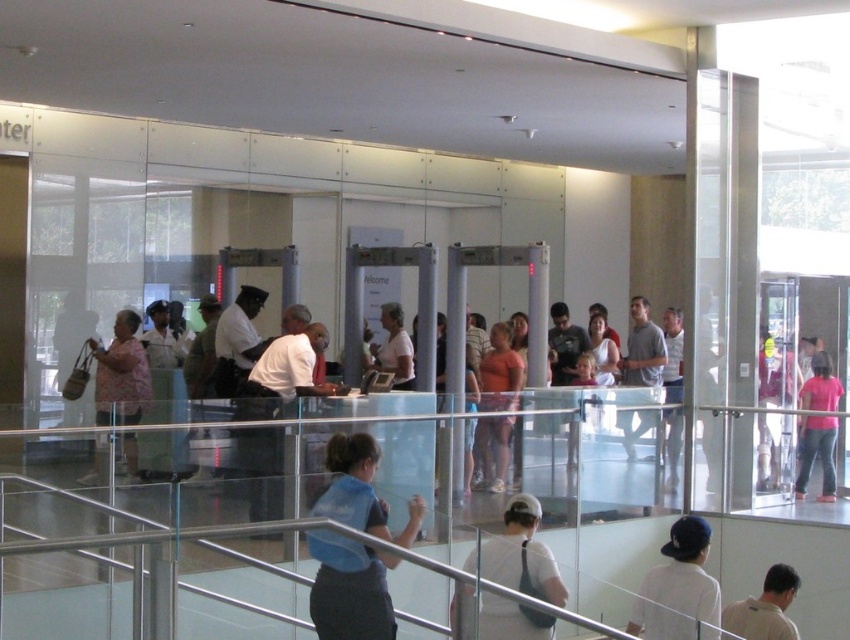
Question: Which object is positioned farthest from the pink fabric shirt at right?

Choices:
 (A) matte pink blouse at center
 (B) white matte uniform at center

Answer: (A)

Question: Which object is positioned closest to the matte pink blouse at center?

Choices:
 (A) white matte cap at upper center
 (B) white matte uniform at center
 (C) pink fabric shirt at right
 (D) blue fabric at center

Answer: (B)

Question: Does blue fabric at center have a smaller size compared to orange matte shirt at center?

Choices:
 (A) no
 (B) yes

Answer: (A)

Question: Which object is the farthest from the pink fabric shirt at right?

Choices:
 (A) white matte t-shirt at center
 (B) white matte uniform at center

Answer: (A)

Question: Does orange matte shirt at center have a smaller size compared to light brown shirt at lower right?

Choices:
 (A) yes
 (B) no

Answer: (B)

Question: Does white matte uniform at center appear under gray cotton shirt at center?

Choices:
 (A) yes
 (B) no

Answer: (A)